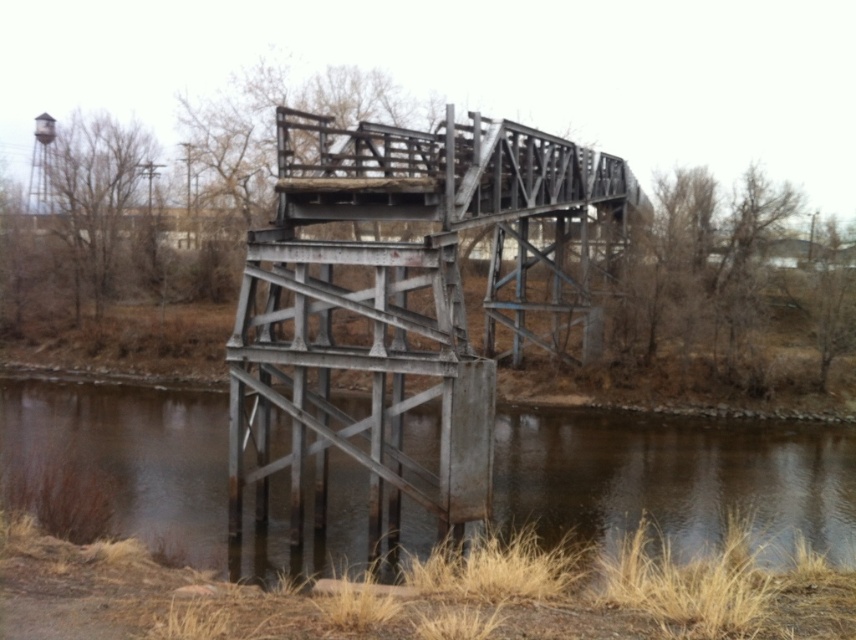
Question: Is rusty metal bridge at center positioned behind brown/rough concrete river at lower center?

Choices:
 (A) yes
 (B) no

Answer: (A)

Question: Can you confirm if rusty metal bridge at center is positioned to the left of brown/rough concrete river at lower center?

Choices:
 (A) yes
 (B) no

Answer: (A)

Question: Is rusty metal bridge at center above brown/rough concrete river at lower center?

Choices:
 (A) yes
 (B) no

Answer: (A)

Question: Which of the following is the closest to the observer?

Choices:
 (A) rusty metal bridge at center
 (B) brown/rough concrete river at lower center

Answer: (B)

Question: Which point appears closest to the camera in this image?

Choices:
 (A) (562, 509)
 (B) (290, 365)

Answer: (B)